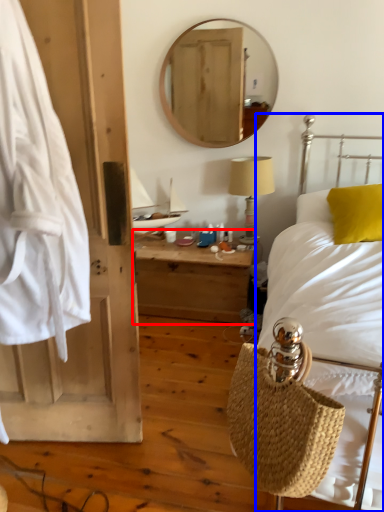
Question: Which point is further to the camera, nightstand (highlighted by a red box) or bed (highlighted by a blue box)?

Choices:
 (A) nightstand
 (B) bed

Answer: (A)